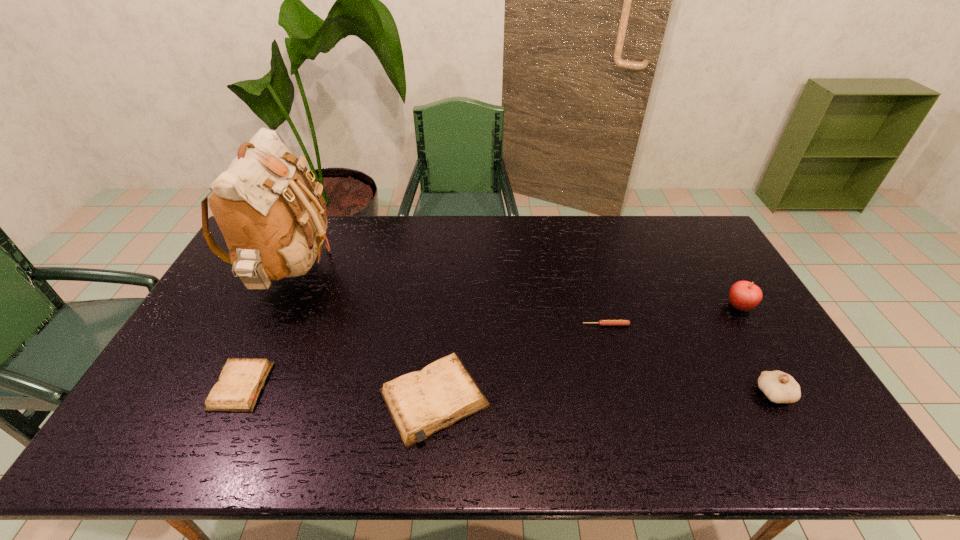
Where is `free point between the fourth nearest object and the apple`? free point between the fourth nearest object and the apple is located at coordinates (673, 315).

At what (x,y) coordinates should I click in order to perform the action: click on vacant space that's between the garlic and the apple. Please return your answer as a coordinate pair (x, y). The height and width of the screenshot is (540, 960). Looking at the image, I should click on (756, 350).

What are the coordinates of `free space between the fourth object from right to left and the backpack` in the screenshot? It's located at (362, 336).

At what (x,y) coordinates should I click in order to perform the action: click on empty space that is in between the garlic and the shortest object. Please return your answer as a coordinate pair (x, y). The image size is (960, 540). Looking at the image, I should click on (690, 359).

Find the location of a particular element. This screenshot has width=960, height=540. unoccupied area between the right diary and the shorter diary is located at coordinates (337, 393).

The width and height of the screenshot is (960, 540). Find the location of `free space between the sausage and the fourth tallest object`. free space between the sausage and the fourth tallest object is located at coordinates (520, 362).

Find the location of a particular element. The height and width of the screenshot is (540, 960). unoccupied position between the backpack and the garlic is located at coordinates (532, 333).

The width and height of the screenshot is (960, 540). I want to click on vacant area that lies between the apple and the backpack, so click(515, 289).

Identify the location of free spot between the apple and the fourth object from left to right. (673, 315).

Find the location of a particular element. vacant space that's between the garlic and the apple is located at coordinates (756, 350).